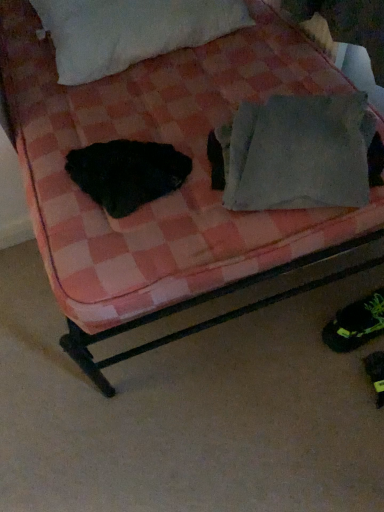
Question: Does white fluffy pillow at upper center, which ranks as the first pillow in back-to-front order, turn towards black fuzzy animal at left?

Choices:
 (A) yes
 (B) no

Answer: (A)

Question: Is black fuzzy animal at left at the back of white fluffy pillow at upper center, the 2th pillow from the bottom?

Choices:
 (A) yes
 (B) no

Answer: (B)

Question: Is white fluffy pillow at upper center, which ranks as the first pillow in back-to-front order, to the left of black fuzzy animal at left from the viewer's perspective?

Choices:
 (A) no
 (B) yes

Answer: (B)

Question: Would you say white fluffy pillow at upper center, marked as the second pillow in a right-to-left arrangement, contains black fuzzy animal at left?

Choices:
 (A) yes
 (B) no

Answer: (B)

Question: From the image's perspective, is white fluffy pillow at upper center, the second pillow when ordered from front to back, beneath black fuzzy animal at left?

Choices:
 (A) no
 (B) yes

Answer: (A)

Question: Is the depth of white fluffy pillow at upper center, marked as the second pillow in a right-to-left arrangement, greater than that of black fuzzy animal at left?

Choices:
 (A) yes
 (B) no

Answer: (A)

Question: Does gray fabric pillow at upper right, the 1th pillow viewed from the right, touch white fluffy pillow at upper center, which ranks as the first pillow in back-to-front order?

Choices:
 (A) yes
 (B) no

Answer: (B)

Question: Is gray fabric pillow at upper right, the second pillow positioned from the top, thinner than white fluffy pillow at upper center, marked as the second pillow in a right-to-left arrangement?

Choices:
 (A) no
 (B) yes

Answer: (B)

Question: Considering the relative sizes of gray fabric pillow at upper right, marked as the 2th pillow in a left-to-right arrangement, and white fluffy pillow at upper center, marked as the second pillow in a right-to-left arrangement, in the image provided, is gray fabric pillow at upper right, marked as the 2th pillow in a left-to-right arrangement, bigger than white fluffy pillow at upper center, marked as the second pillow in a right-to-left arrangement,?

Choices:
 (A) no
 (B) yes

Answer: (A)

Question: Would you consider gray fabric pillow at upper right, the second pillow positioned from the top, to be distant from white fluffy pillow at upper center, the second pillow when ordered from front to back?

Choices:
 (A) yes
 (B) no

Answer: (B)

Question: Considering the relative sizes of gray fabric pillow at upper right, which appears as the first pillow when ordered from the bottom, and white fluffy pillow at upper center, the second pillow when ordered from front to back, in the image provided, is gray fabric pillow at upper right, which appears as the first pillow when ordered from the bottom, smaller than white fluffy pillow at upper center, the second pillow when ordered from front to back,?

Choices:
 (A) yes
 (B) no

Answer: (A)

Question: Is gray fabric pillow at upper right, the 1th pillow viewed from the right, further to camera compared to white fluffy pillow at upper center, the 2th pillow from the bottom?

Choices:
 (A) no
 (B) yes

Answer: (A)

Question: Could you tell me if black fuzzy animal at left is turned towards white fluffy pillow at upper center, positioned as the 1th pillow in left-to-right order?

Choices:
 (A) no
 (B) yes

Answer: (A)